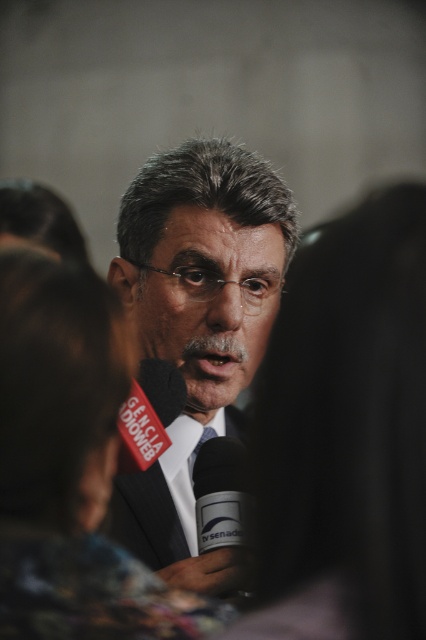
Question: Which point is closer to the camera?

Choices:
 (A) matte black suit at center
 (B) black matte suit at lower center

Answer: (B)

Question: Among these points, which one is nearest to the camera?

Choices:
 (A) (178, 554)
 (B) (207, 216)
 (C) (247, 483)

Answer: (C)

Question: Does matte black suit at center have a smaller size compared to black matte microphone at center?

Choices:
 (A) yes
 (B) no

Answer: (B)

Question: Is matte black suit at center positioned behind blue silk tie at center?

Choices:
 (A) no
 (B) yes

Answer: (A)

Question: Observing the image, what is the correct spatial positioning of black matte suit at lower center in reference to blue silk tie at center?

Choices:
 (A) above
 (B) below

Answer: (B)

Question: Estimate the real-world distances between objects in this image. Which object is closer to the matte black suit at center?

Choices:
 (A) black matte microphone at center
 (B) blue silk tie at center
 (C) black matte suit at lower center

Answer: (C)